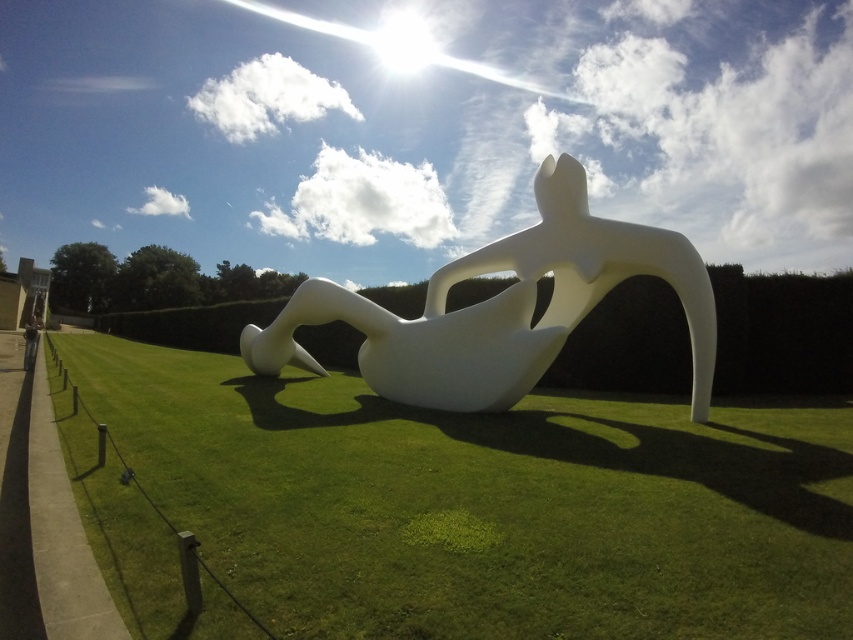
Question: Is green grass at center closer to the viewer compared to white glossy sculpture at center?

Choices:
 (A) yes
 (B) no

Answer: (A)

Question: Does green grass at center appear under white glossy sculpture at center?

Choices:
 (A) no
 (B) yes

Answer: (B)

Question: Which point is farther to the camera?

Choices:
 (A) green grass at center
 (B) white glossy sculpture at center

Answer: (B)

Question: From the image, what is the correct spatial relationship of green grass at center in relation to white glossy sculpture at center?

Choices:
 (A) above
 (B) below

Answer: (B)

Question: Which of the following is the closest to the observer?

Choices:
 (A) white glossy sculpture at center
 (B) green grass at center

Answer: (B)